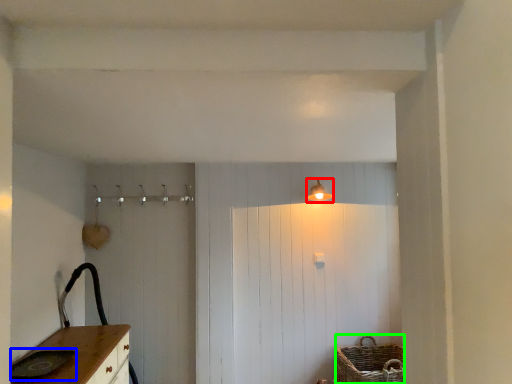
Question: Based on their relative distances, which object is farther from light fixture (highlighted by a red box)? Choose from sink (highlighted by a blue box) and basket (highlighted by a green box).

Choices:
 (A) sink
 (B) basket

Answer: (A)